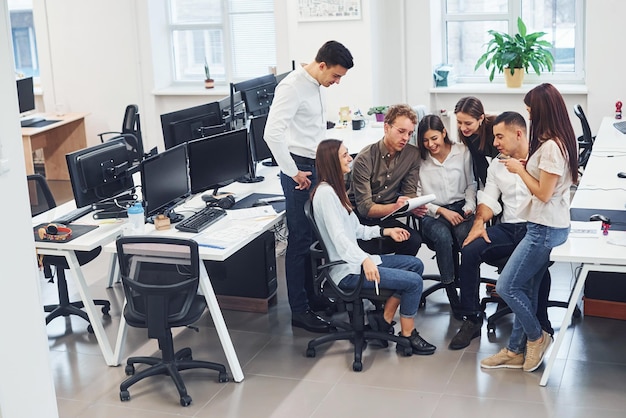
The width and height of the screenshot is (626, 418). Find the location of `computers`. computers is located at coordinates (163, 181), (113, 179), (131, 126), (183, 119), (216, 149), (249, 95), (235, 101), (259, 128), (287, 71).